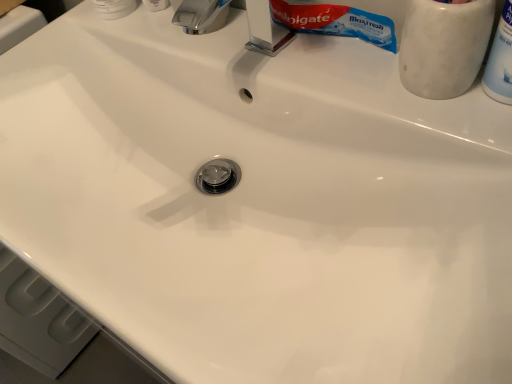
Locate an element on the screen. vacant space situated on the left part of chrome metallic faucet at upper center is located at coordinates (116, 39).